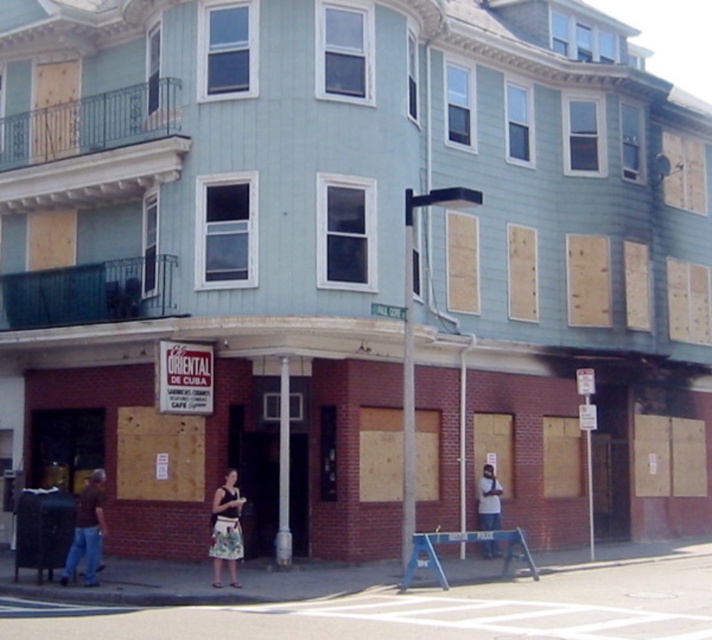
Question: Which point is closer to the camera?

Choices:
 (A) (239, 522)
 (B) (89, 499)
 (C) (491, 522)

Answer: (B)

Question: Which object appears farthest from the camera in this image?

Choices:
 (A) brown denim jeans at lower left
 (B) light blue denim jeans at lower center

Answer: (B)

Question: Can you confirm if brown denim jeans at lower left is wider than light blue denim jeans at lower center?

Choices:
 (A) no
 (B) yes

Answer: (B)

Question: Is brown denim jeans at lower left thinner than floral skirt at center?

Choices:
 (A) yes
 (B) no

Answer: (B)

Question: Is brown denim jeans at lower left positioned in front of light blue denim jeans at lower center?

Choices:
 (A) yes
 (B) no

Answer: (A)

Question: Which point appears closest to the camera in this image?

Choices:
 (A) (89, 483)
 (B) (214, 573)
 (C) (498, 513)

Answer: (B)